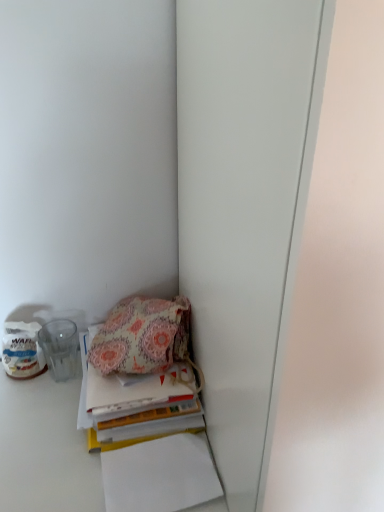
Identify the location of floral fabric handbag at lower left. This screenshot has width=384, height=512. (142, 336).

What do you see at coordinates (142, 336) in the screenshot?
I see `floral fabric handbag at lower left` at bounding box center [142, 336].

At what (x,y) coordinates should I click in order to perform the action: click on floral fabric book at lower left. Please return your answer as a coordinate pair (x, y). Image resolution: width=384 pixels, height=512 pixels. Looking at the image, I should click on (135, 404).

What do you see at coordinates (135, 404) in the screenshot? Image resolution: width=384 pixels, height=512 pixels. I see `floral fabric book at lower left` at bounding box center [135, 404].

The image size is (384, 512). What are the coordinates of `floral fabric handbag at lower left` in the screenshot? It's located at (142, 336).

Between floral fabric handbag at lower left and floral fabric book at lower left, which one appears on the right side from the viewer's perspective?

floral fabric book at lower left.

Considering the relative positions of floral fabric handbag at lower left and floral fabric book at lower left in the image provided, is floral fabric handbag at lower left behind floral fabric book at lower left?

Yes, the depth of floral fabric handbag at lower left is greater than that of floral fabric book at lower left.

Does point (181, 338) appear closer or farther from the camera than point (194, 384)?

Clearly, point (181, 338) is more distant from the camera than point (194, 384).

From the image's perspective, would you say floral fabric handbag at lower left is shown under floral fabric book at lower left?

No.

From a real-world perspective, is floral fabric handbag at lower left positioned above or below floral fabric book at lower left?

From a real-world perspective, floral fabric handbag at lower left is physically above floral fabric book at lower left.

Consider the image. Does floral fabric handbag at lower left have a greater width compared to floral fabric book at lower left?

No, floral fabric handbag at lower left is not wider than floral fabric book at lower left.

From their relative heights in the image, would you say floral fabric handbag at lower left is taller or shorter than floral fabric book at lower left?

In the image, floral fabric handbag at lower left appears to be taller than floral fabric book at lower left.

Looking at the image, does floral fabric handbag at lower left seem bigger or smaller compared to floral fabric book at lower left?

floral fabric handbag at lower left is smaller than floral fabric book at lower left.

Choose the correct answer: Is floral fabric handbag at lower left inside floral fabric book at lower left or outside it?

floral fabric handbag at lower left is located beyond the bounds of floral fabric book at lower left.

Are floral fabric handbag at lower left and floral fabric book at lower left beside each other?

Yes, floral fabric handbag at lower left is right next to floral fabric book at lower left and making contact.

Is floral fabric book at lower left at the back of floral fabric handbag at lower left?

No, floral fabric book at lower left is not at the back of floral fabric handbag at lower left.

How different are the orientations of floral fabric handbag at lower left and floral fabric book at lower left in degrees?

0.473 degrees separate the facing orientations of floral fabric handbag at lower left and floral fabric book at lower left.

Locate an element on the screen. paperback book in front of the floral fabric handbag at lower left is located at coordinates (135, 404).

Considering the relative positions of floral fabric book at lower left and floral fabric handbag at lower left in the image provided, is floral fabric book at lower left to the left or to the right of floral fabric handbag at lower left?

From the image, it's evident that floral fabric book at lower left is to the right of floral fabric handbag at lower left.

Relative to floral fabric handbag at lower left, is floral fabric book at lower left in front or behind?

floral fabric book at lower left is in front of floral fabric handbag at lower left.

Which is behind, point (180, 422) or point (127, 343)?

Point (127, 343)

From the image's perspective, is floral fabric book at lower left located above floral fabric handbag at lower left?

No.

From a real-world perspective, between floral fabric book at lower left and floral fabric handbag at lower left, who is vertically higher?

floral fabric handbag at lower left is physically above.

Considering the sizes of objects floral fabric book at lower left and floral fabric handbag at lower left in the image provided, who is thinner, floral fabric book at lower left or floral fabric handbag at lower left?

floral fabric handbag at lower left.

Which of these two, floral fabric book at lower left or floral fabric handbag at lower left, stands taller?

floral fabric handbag at lower left is taller.

Considering the sizes of objects floral fabric book at lower left and floral fabric handbag at lower left in the image provided, who is bigger, floral fabric book at lower left or floral fabric handbag at lower left?

With larger size is floral fabric book at lower left.

Can floral fabric handbag at lower left be found inside floral fabric book at lower left?

Definitely not — floral fabric handbag at lower left is not inside floral fabric book at lower left.

Can you see floral fabric book at lower left touching floral fabric handbag at lower left?

Yes, floral fabric book at lower left is in contact with floral fabric handbag at lower left.

Is floral fabric book at lower left aimed at floral fabric handbag at lower left?

No, floral fabric book at lower left does not turn towards floral fabric handbag at lower left.

Locate an element on the screen. The height and width of the screenshot is (512, 384). paperback book below the floral fabric handbag at lower left (from a real-world perspective) is located at coordinates [135, 404].

Where is `paperback book below the floral fabric handbag at lower left (from the image's perspective)`? This screenshot has height=512, width=384. paperback book below the floral fabric handbag at lower left (from the image's perspective) is located at coordinates (135, 404).

At what (x,y) coordinates should I click in order to perform the action: click on handbag above the floral fabric book at lower left (from a real-world perspective). Please return your answer as a coordinate pair (x, y). The width and height of the screenshot is (384, 512). Looking at the image, I should click on (142, 336).